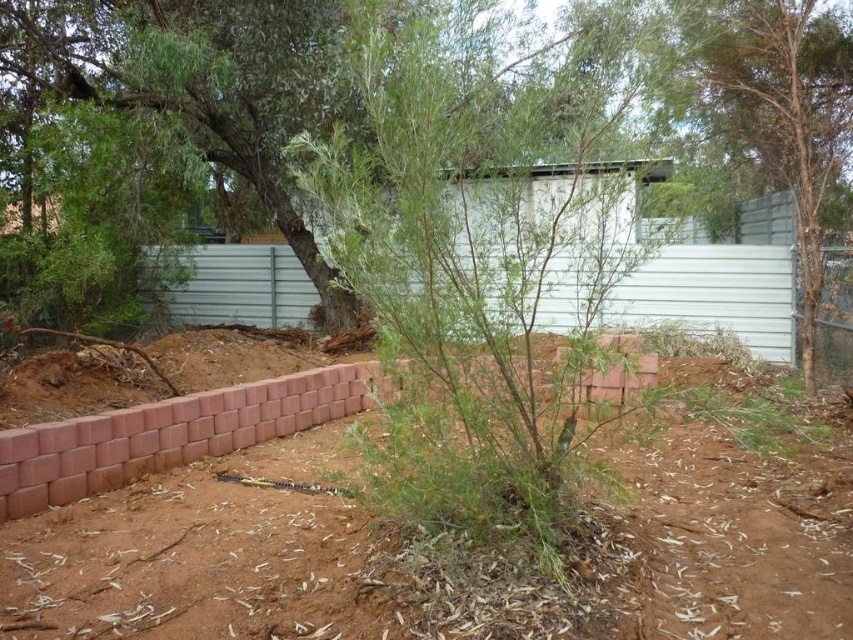
Which is more to the right, green leafy tree at center or metallic silver fence at right?

green leafy tree at center is more to the right.

Which is in front, point (827, 77) or point (834, 278)?

Point (834, 278) is in front.

Who is more distant from viewer, (834,129) or (839,376)?

The point (834,129) is more distant.

This screenshot has width=853, height=640. Find the location of `green leafy tree at center`. green leafy tree at center is located at coordinates (782, 108).

Does point (281, 202) come behind point (810, 305)?

Yes, point (281, 202) is behind point (810, 305).

At what (x,y) coordinates should I click in order to perform the action: click on green leafy bush at center. Please return your answer as a coordinate pair (x, y). This screenshot has width=853, height=640. Looking at the image, I should click on (199, 77).

Who is positioned more to the left, green leafy bush at center or metallic silver fence at right?

green leafy bush at center

Where is `green leafy bush at center`? green leafy bush at center is located at coordinates (199, 77).

The height and width of the screenshot is (640, 853). In order to click on green leafy bush at center in this screenshot , I will do `click(199, 77)`.